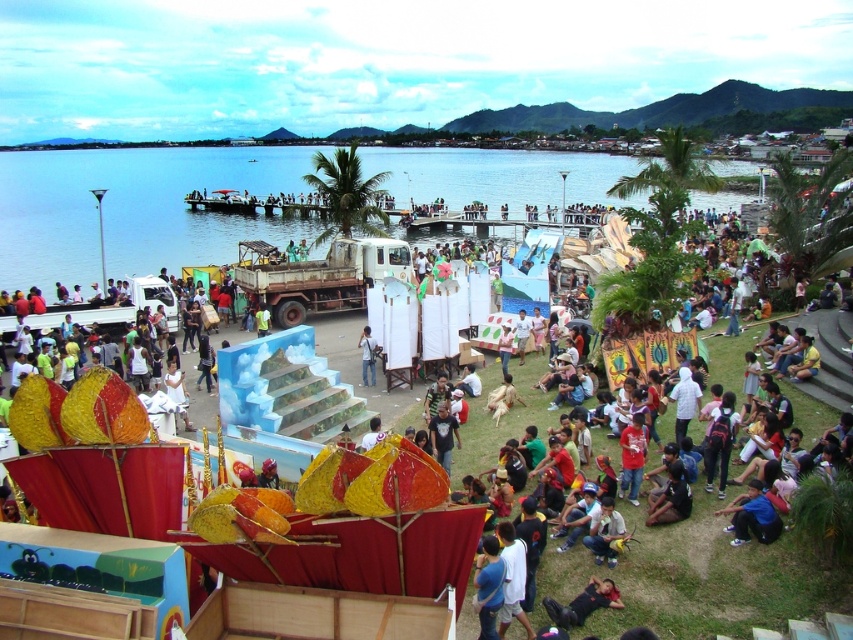
Is blue water at center to the left of light blue fabric at center from the viewer's perspective?

Correct, you'll find blue water at center to the left of light blue fabric at center.

Can you confirm if blue water at center is positioned to the right of light blue fabric at center?

No, blue water at center is not to the right of light blue fabric at center.

Is point (253, 168) positioned behind point (366, 381)?

Yes, point (253, 168) is farther from viewer.

Locate an element on the screen. blue water at center is located at coordinates (135, 211).

Does black fabric person at lower center have a larger size compared to light blue fabric at center?

Correct, black fabric person at lower center is larger in size than light blue fabric at center.

Does black fabric person at lower center have a greater height compared to light blue fabric at center?

In fact, black fabric person at lower center may be shorter than light blue fabric at center.

Find the location of a particular element. Image resolution: width=853 pixels, height=640 pixels. black fabric person at lower center is located at coordinates (583, 602).

Between blue water at center and black fabric person at lower center, which one appears on the left side from the viewer's perspective?

From the viewer's perspective, blue water at center appears more on the left side.

What do you see at coordinates (135, 211) in the screenshot? I see `blue water at center` at bounding box center [135, 211].

Where is `blue water at center`? The image size is (853, 640). blue water at center is located at coordinates (135, 211).

You are a GUI agent. You are given a task and a screenshot of the screen. Output one action in this format:
    pyautogui.click(x=<x>, y=<y>)
    Task: Click on the blue water at center
    
    Given the screenshot: What is the action you would take?
    pyautogui.click(x=135, y=211)